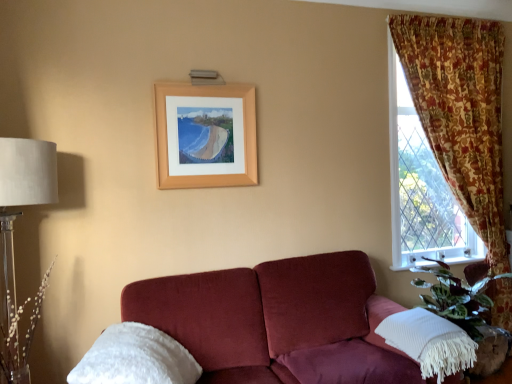
Question: From the image's perspective, is wooden frame at upper center located above or below white plastic at lower right?

Choices:
 (A) above
 (B) below

Answer: (A)

Question: Does point (x=212, y=178) appear closer or farther from the camera than point (x=477, y=258)?

Choices:
 (A) farther
 (B) closer

Answer: (A)

Question: Considering the real-world distances, which object is farthest from the white textured pillow at lower right, arranged as the 2th pillow when viewed from the left?

Choices:
 (A) floral fabric curtain at right
 (B) green leafy plant at lower right
 (C) wooden frame at upper center
 (D) translucent glass table lamp at left
 (E) white fluffy pillow at lower left, marked as the 2th pillow in a right-to-left arrangement

Answer: (D)

Question: Which is nearer to the white plastic at lower right?

Choices:
 (A) translucent glass table lamp at left
 (B) white fluffy pillow at lower left, which appears as the 1th pillow when viewed from the left
 (C) floral fabric curtain at right
 (D) white textured pillow at lower right, acting as the 1th pillow starting from the right
 (E) green leafy plant at lower right

Answer: (E)